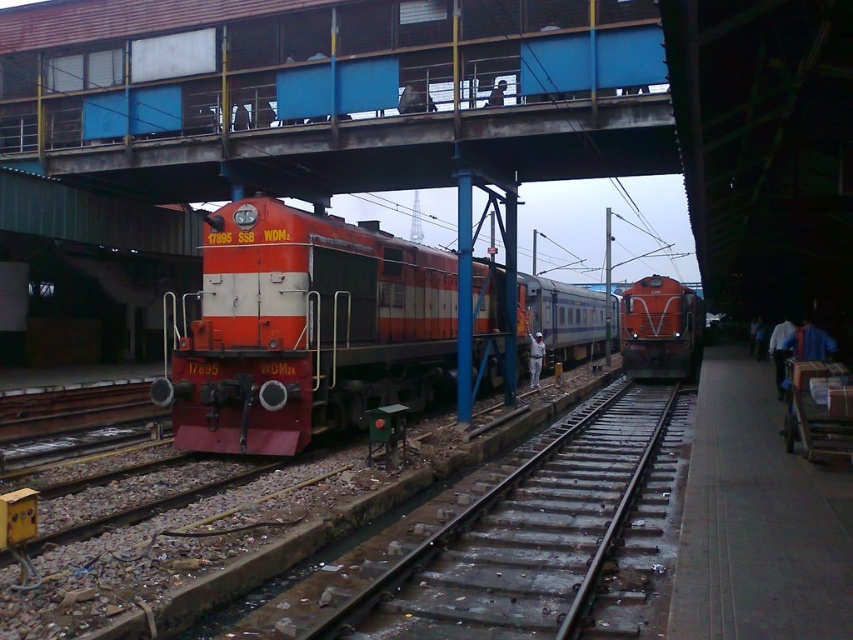
Question: Which point is closer to the camera?

Choices:
 (A) (233, 424)
 (B) (96, 166)

Answer: (A)

Question: Is rusty metal bridge at upper center below orange matte train at center?

Choices:
 (A) no
 (B) yes

Answer: (A)

Question: Which object appears closest to the camera in this image?

Choices:
 (A) rusty metal bridge at upper center
 (B) metal/rough train track at center
 (C) orange matte train at center
 (D) matte orange train at center

Answer: (B)

Question: From the image, what is the correct spatial relationship of metal/rough train track at center in relation to matte orange train at center?

Choices:
 (A) above
 (B) below

Answer: (B)

Question: Is rusty metal bridge at upper center wider than matte orange train at center?

Choices:
 (A) yes
 (B) no

Answer: (A)

Question: Which of the following is the farthest from the observer?

Choices:
 (A) rusty metal bridge at upper center
 (B) metal/rough train track at center

Answer: (A)